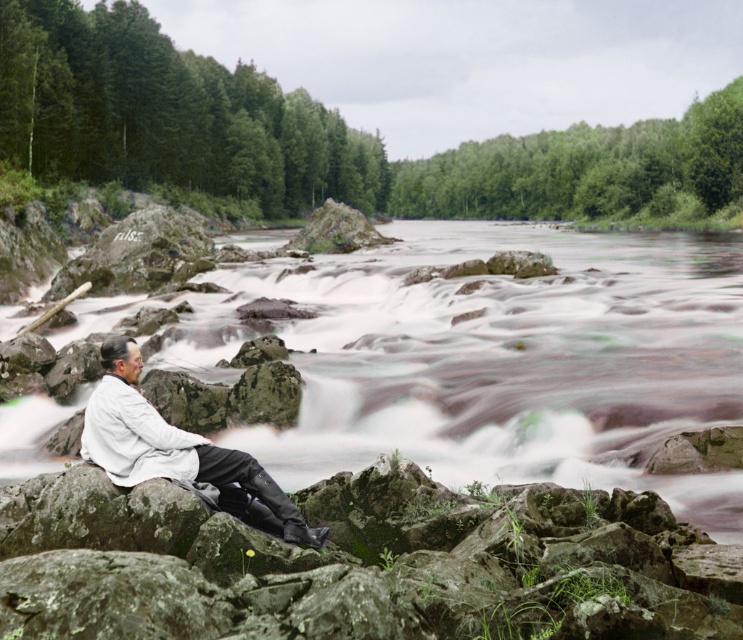
You are a photographer trying to capture the man in the scene. Since the white matte shirt at lower left and the white frothy water at center are both white, how can you ensure the man is clearly visible in your photo?

The white matte shirt at lower left is behind the white frothy water at center, so you can focus on the shirt to ensure the man stands out against the frothy water in the foreground.

You are standing at the point closer to the camera in this scene. Which point are you at, point (418, 362) or point (256, 508)?

You are at point (418, 362) because it is further to the viewer than point (256, 508).

You are a photographer trying to capture the man in the scene. You notice the white frothy water at center and the white matte shirt at lower left. Which object is positioned higher in the frame?

The white frothy water at center is located above the white matte shirt at lower left, so it is positioned higher in the frame.